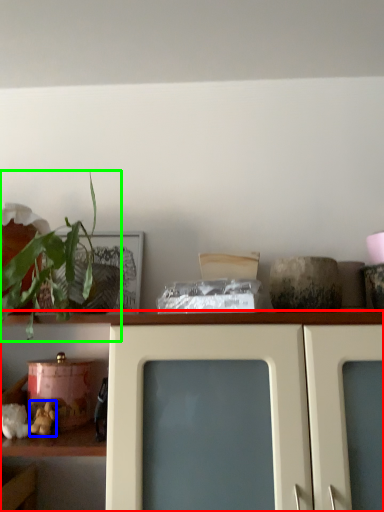
Question: Based on their relative distances, which object is farther from shelf (highlighted by a red box)? Choose from stuff (highlighted by a blue box) and houseplant (highlighted by a green box).

Choices:
 (A) stuff
 (B) houseplant

Answer: (A)